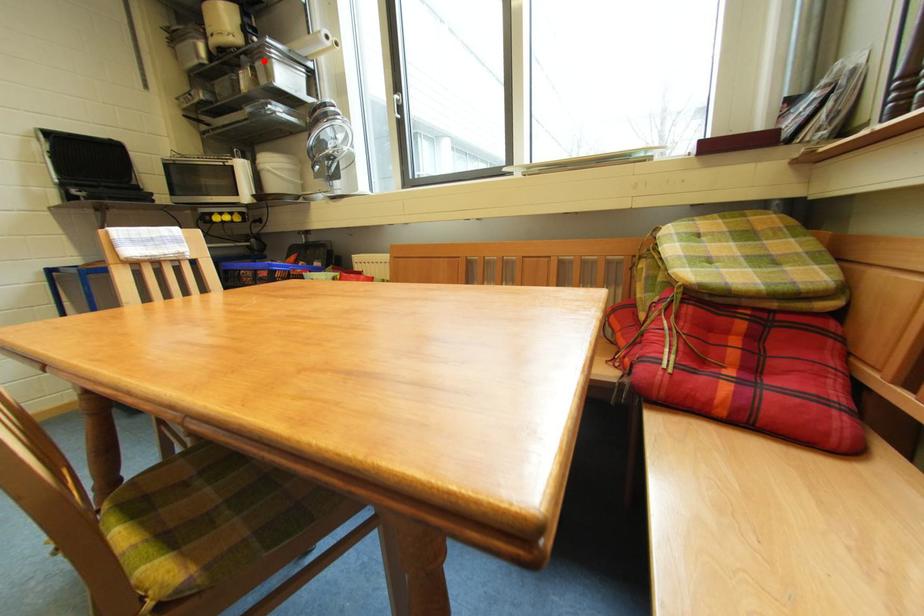
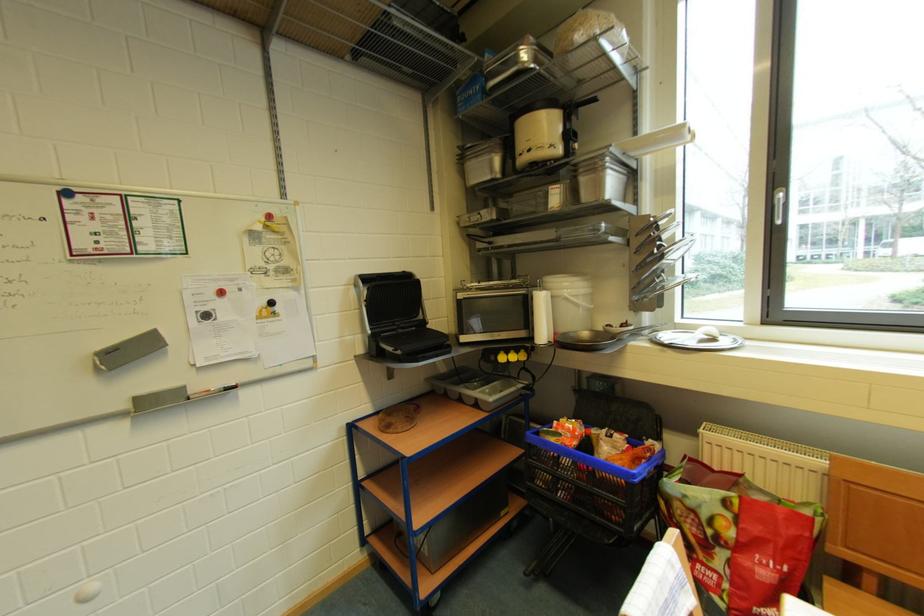
Find the pixel in the second image that matches the highlighted location in the first image.

(589, 174)